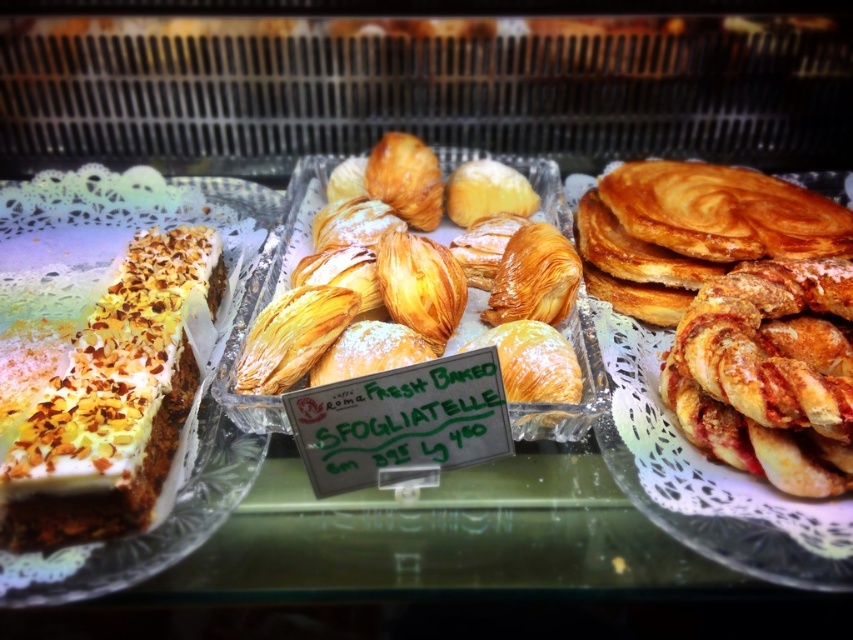
Is white cream topped with nuts at center to the left of swirled golden pancake at right from the viewer's perspective?

Yes, white cream topped with nuts at center is to the left of swirled golden pancake at right.

Who is more distant from viewer, (173,376) or (751,241)?

The point (751,241) is more distant.

What are the coordinates of `white cream topped with nuts at center` in the screenshot? It's located at (105, 396).

Who is higher up, golden flaky pastry at center or swirled golden pancake at right?

Positioned higher is swirled golden pancake at right.

Who is shorter, golden flaky pastry at center or swirled golden pancake at right?

swirled golden pancake at right is shorter.

Locate an element on the screen. golden flaky pastry at center is located at coordinates (354, 292).

What are the coordinates of `golden flaky pastry at center` in the screenshot? It's located at [x=354, y=292].

Which is behind, point (55, 460) or point (387, 250)?

The point (387, 250) is behind.

Between point (22, 442) and point (395, 284), which one is positioned in front?

Positioned in front is point (22, 442).

Does point (170, 452) lie behind point (345, 234)?

No, (170, 452) is in front of (345, 234).

Identify the location of white cream topped with nuts at center. The image size is (853, 640). (105, 396).